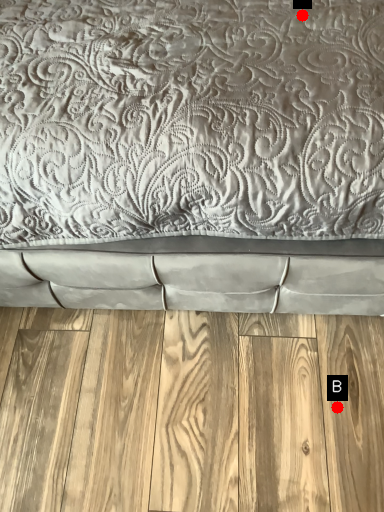
Question: Two points are circled on the image, labeled by A and B beside each circle. Which point appears farthest from the camera in this image?

Choices:
 (A) A is further
 (B) B is further

Answer: (B)